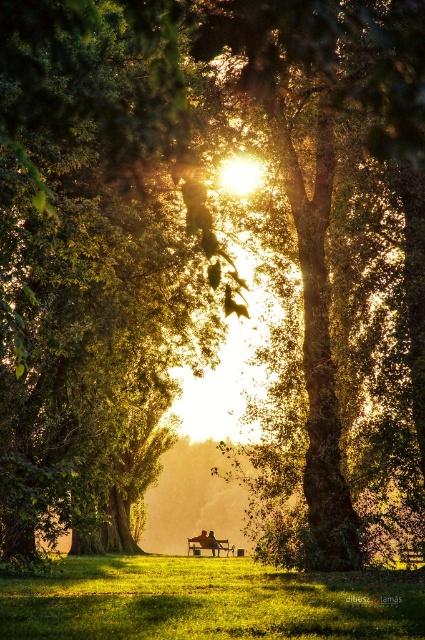
Question: Does wooden bench at center have a smaller size compared to red fabric person at center?

Choices:
 (A) no
 (B) yes

Answer: (A)

Question: Which point is closer to the camera taking this photo?

Choices:
 (A) (206, 538)
 (B) (209, 532)

Answer: (A)

Question: Is wooden bench at center above red fabric person at center?

Choices:
 (A) yes
 (B) no

Answer: (A)

Question: Does wooden bench at center have a greater width compared to red fabric person at center?

Choices:
 (A) no
 (B) yes

Answer: (B)